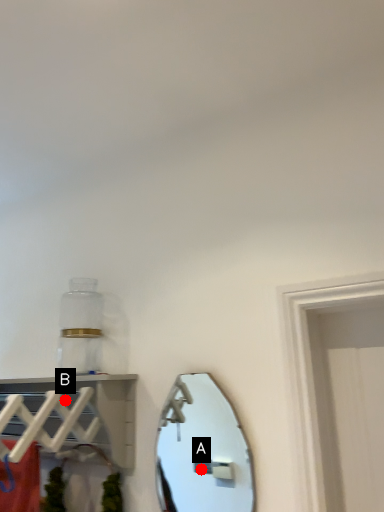
Question: Two points are circled on the image, labeled by A and B beside each circle. Which of the following is the farthest from the observer?

Choices:
 (A) A is further
 (B) B is further

Answer: (A)